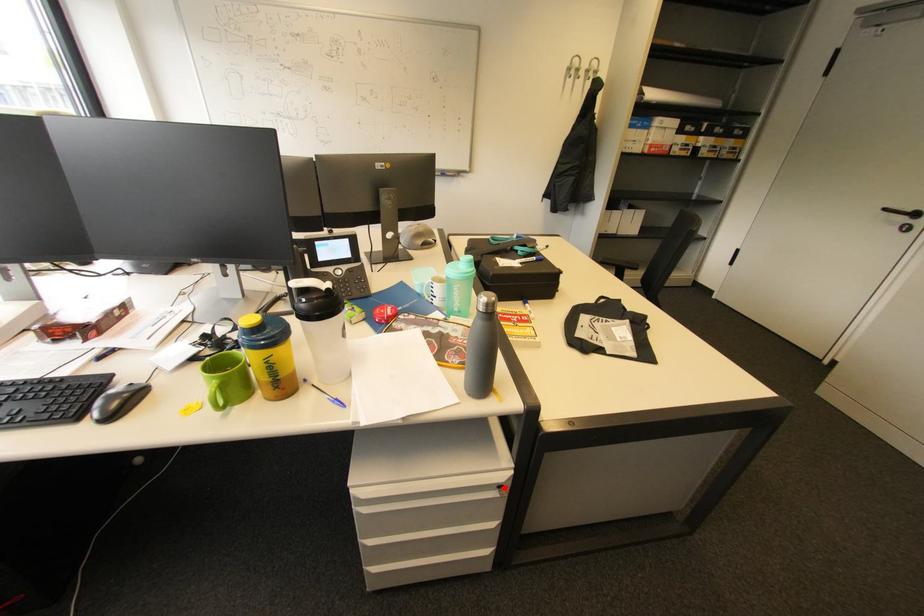
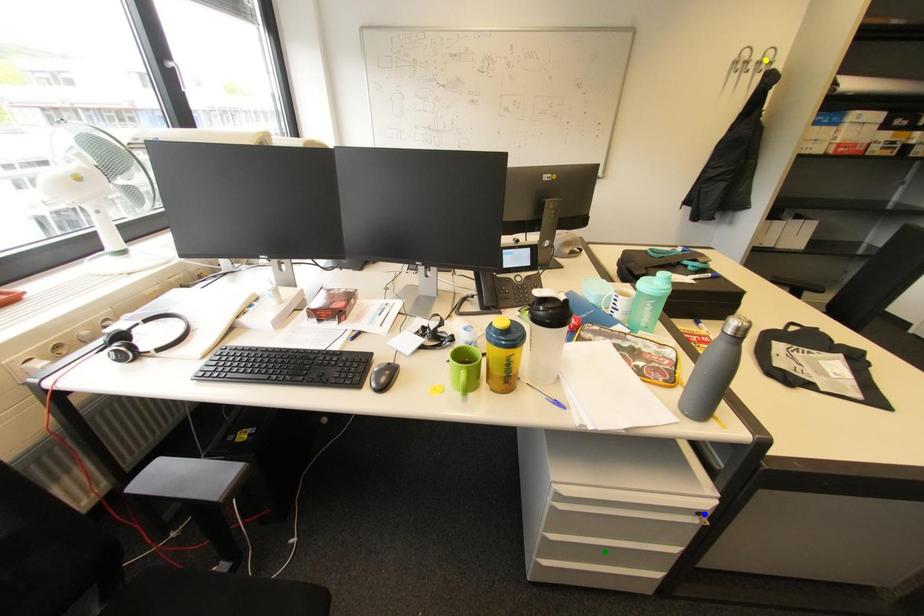
Question: I am providing you with two images of the same scene from different viewpoints. A red point is marked on the first image. You are given multiple points on the second image. Can you choose the point in image 2 that corresponds to the point in image 1?

Choices:
 (A) blue point
 (B) yellow point
 (C) green point

Answer: (A)